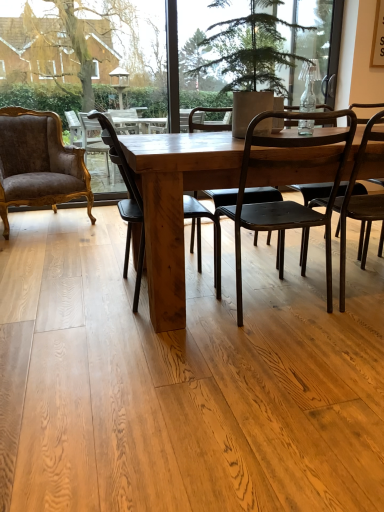
You are a GUI agent. You are given a task and a screenshot of the screen. Output one action in this format:
    pyautogui.click(x=<x>, y=<y>)
    Task: Click on the free point behind matte black chair at right, which ranks as the 1th chair in right-to-left order
    The width and height of the screenshot is (384, 512).
    Given the screenshot: What is the action you would take?
    point(317,260)